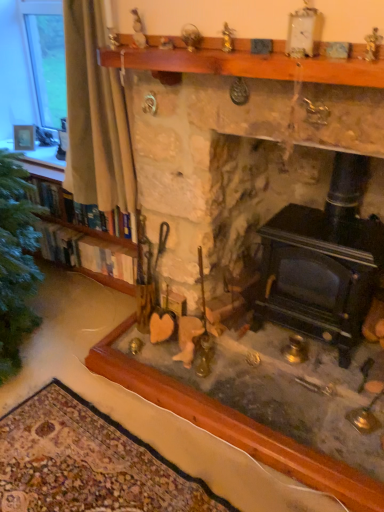
Question: Considering the positions of point (213, 418) and point (329, 290), is point (213, 418) closer or farther from the camera than point (329, 290)?

Choices:
 (A) farther
 (B) closer

Answer: (B)

Question: In terms of height, does stone fireplace at center look taller or shorter compared to black cast iron wood burning stove at lower right?

Choices:
 (A) tall
 (B) short

Answer: (A)

Question: Considering the real-world distances, which object is farthest from the matte silver picture frame at upper left?

Choices:
 (A) black cast iron wood burning stove at lower right
 (B) stone fireplace at center
 (C) wooden bookshelf at left
 (D) wooden mantle at upper center
 (E) white fabric curtain at left

Answer: (A)

Question: Which object is positioned closest to the wooden mantle at upper center?

Choices:
 (A) white fabric curtain at left
 (B) stone fireplace at center
 (C) wooden bookshelf at left
 (D) black cast iron wood burning stove at lower right
 (E) matte silver picture frame at upper left

Answer: (A)